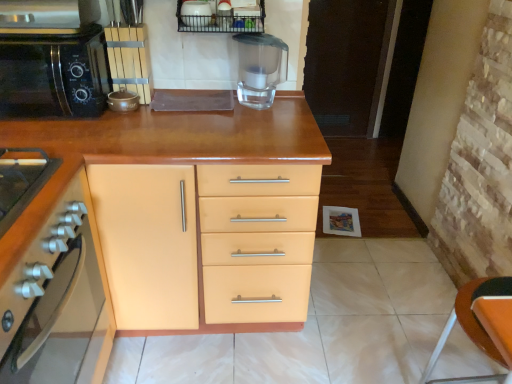
Question: Is white glossy bowl at upper center, the 2th appliance when ordered from bottom to top, behind metallic wire basket at upper center?

Choices:
 (A) yes
 (B) no

Answer: (B)

Question: Is white glossy bowl at upper center, marked as the first appliance in a right-to-left arrangement, facing away from metallic wire basket at upper center?

Choices:
 (A) yes
 (B) no

Answer: (A)

Question: Does white glossy bowl at upper center, marked as the first appliance in a right-to-left arrangement, have a larger size compared to metallic wire basket at upper center?

Choices:
 (A) no
 (B) yes

Answer: (A)

Question: From a real-world perspective, is white glossy bowl at upper center, the 2th appliance when ordered from bottom to top, located higher than metallic wire basket at upper center?

Choices:
 (A) yes
 (B) no

Answer: (A)

Question: Is white glossy bowl at upper center, marked as the first appliance in a right-to-left arrangement, next to metallic wire basket at upper center and touching it?

Choices:
 (A) no
 (B) yes

Answer: (B)

Question: From the image's perspective, relative to transparent plastic blender at center, is black matte microwave at left above or below?

Choices:
 (A) below
 (B) above

Answer: (A)

Question: In terms of height, does black matte microwave at left look taller or shorter compared to transparent plastic blender at center?

Choices:
 (A) tall
 (B) short

Answer: (A)

Question: Is black matte microwave at left wider or thinner than transparent plastic blender at center?

Choices:
 (A) thin
 (B) wide

Answer: (B)

Question: From a real-world perspective, is black matte microwave at left above or below transparent plastic blender at center?

Choices:
 (A) above
 (B) below

Answer: (B)

Question: From a real-world perspective, is black matte microwave at left positioned above or below metallic wire basket at upper center?

Choices:
 (A) above
 (B) below

Answer: (B)

Question: Choose the correct answer: Is black matte microwave at left inside metallic wire basket at upper center or outside it?

Choices:
 (A) inside
 (B) outside

Answer: (B)

Question: Considering the positions of black matte microwave at left and metallic wire basket at upper center in the image, is black matte microwave at left bigger or smaller than metallic wire basket at upper center?

Choices:
 (A) big
 (B) small

Answer: (A)

Question: In terms of width, does black matte microwave at left look wider or thinner when compared to metallic wire basket at upper center?

Choices:
 (A) thin
 (B) wide

Answer: (B)

Question: From the image's perspective, relative to matte orange cabinet at left, the 2th cabinetry viewed from the back, is matte brown pot at upper left, the first appliance from the bottom, above or below?

Choices:
 (A) above
 (B) below

Answer: (A)

Question: Relative to matte orange cabinet at left, the 2th cabinetry viewed from the back, is matte brown pot at upper left, arranged as the 2th appliance when viewed from the right, in front or behind?

Choices:
 (A) behind
 (B) front

Answer: (A)